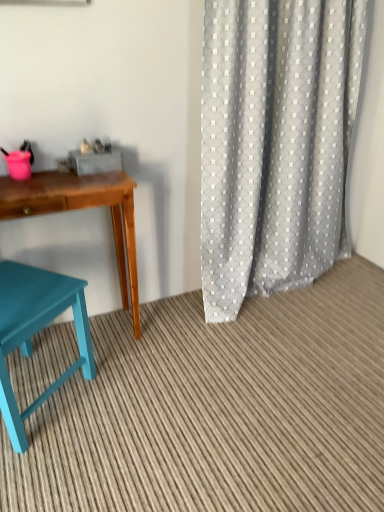
Question: Visually, is teal wood stool at lower left positioned to the left or to the right of teal painted wood chair at lower left?

Choices:
 (A) left
 (B) right

Answer: (B)

Question: Considering their positions, is teal wood stool at lower left located in front of or behind teal painted wood chair at lower left?

Choices:
 (A) front
 (B) behind

Answer: (A)

Question: Estimate the real-world distances between objects in this image. Which object is closer to the teal painted wood chair at lower left?

Choices:
 (A) gray textured curtain at right
 (B) teal wood desk at left
 (C) teal wood stool at lower left

Answer: (B)

Question: Estimate the real-world distances between objects in this image. Which object is closer to the teal wood desk at left?

Choices:
 (A) gray textured curtain at right
 (B) teal wood stool at lower left
 (C) teal painted wood chair at lower left

Answer: (C)